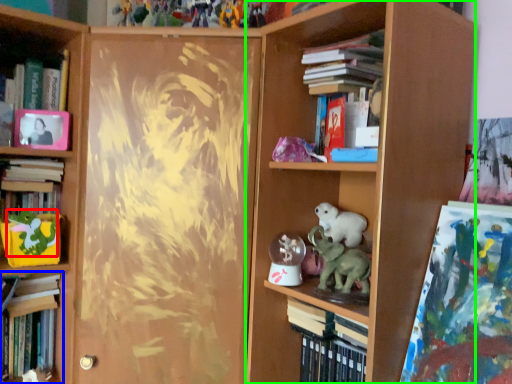
Question: Which object is the farthest from animal (highlighted by a red box)? Choose among these: book (highlighted by a blue box) or bookcase (highlighted by a green box).

Choices:
 (A) book
 (B) bookcase

Answer: (B)